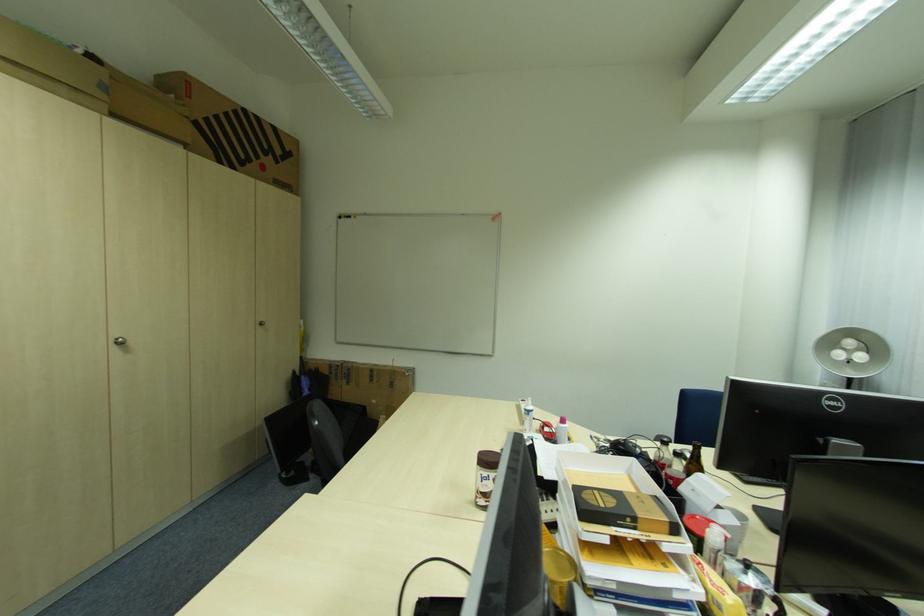
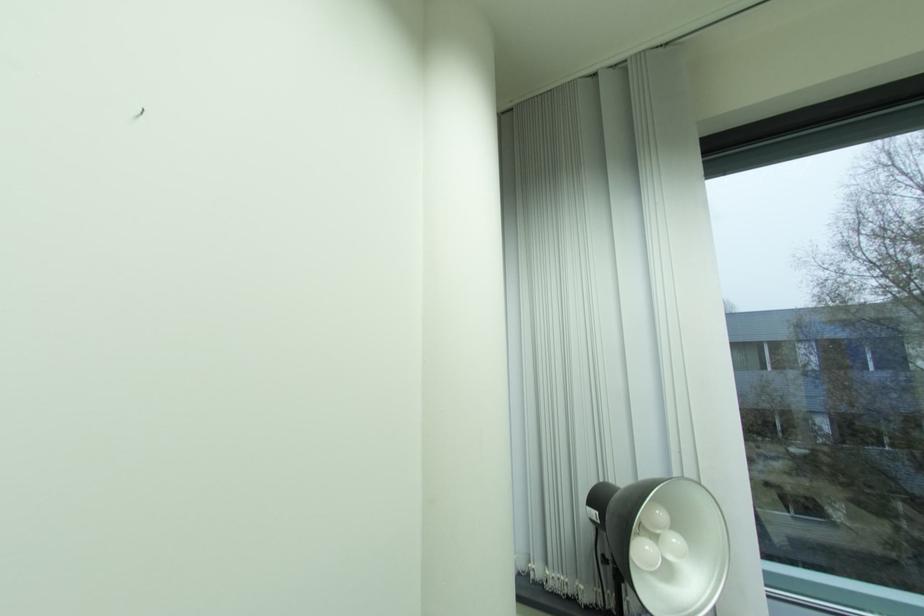
In the second image, find the point that corresponds to (857,349) in the first image.

(665, 531)